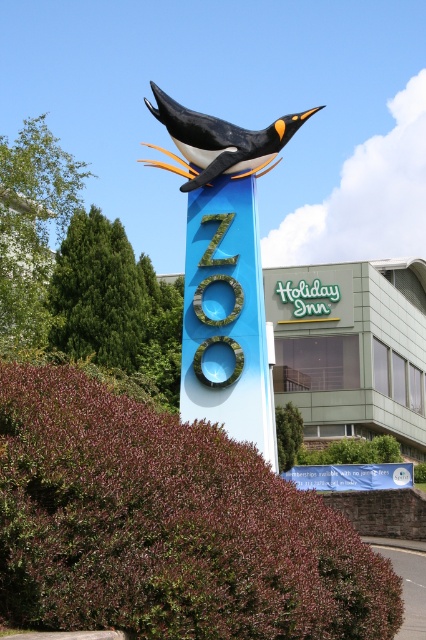
You are standing at the entrance of the zoo and see the sign with a penguin sculpture. Where is the penguin located on the sign? Please provide coordinates in the format of a point like point (224, 269).

The penguin is located at point (224, 269) on the sign.

You are a visitor approaching the zoo entrance and see the matte blue penguin at center and the blue fabric banner at center. Which object would you see first as you walk towards the entrance?

The matte blue penguin at center is located above the blue fabric banner at center, so you would see the matte blue penguin at center first as you approach the entrance.

You are a visitor at the zoo entrance and want to take a photo of both the polished blue penguin at center and the blue fabric banner at center. Which object should you focus on first if you want to ensure both are in the frame without moving the camera?

Since the polished blue penguin at center is taller than the blue fabric banner at center, you should focus on the polished blue penguin at center first to ensure both fit in the frame.